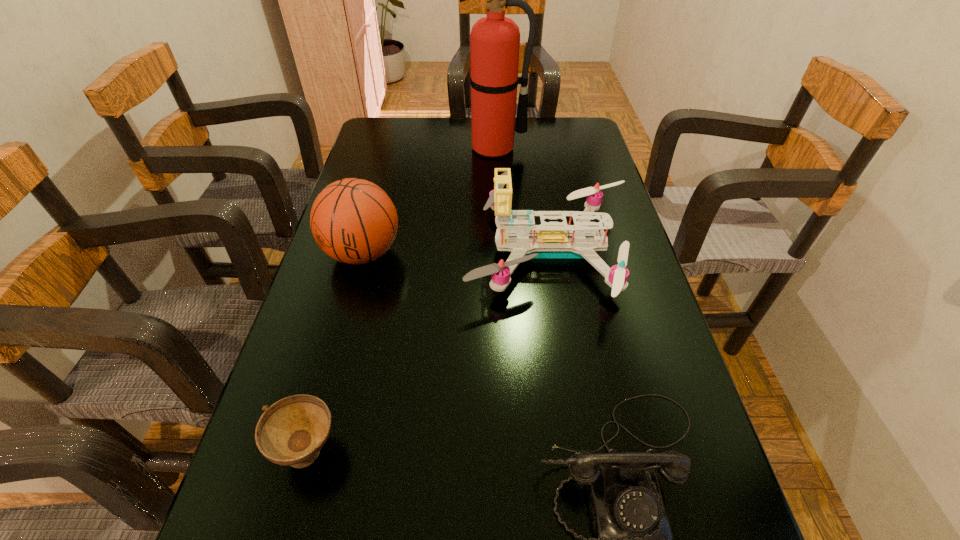
I want to click on free space located on the back of the soup bowl, so click(353, 285).

Locate an element on the screen. This screenshot has width=960, height=540. object that is positioned at the far edge is located at coordinates (494, 40).

Find the location of `basketball located in the left edge section of the desktop`. basketball located in the left edge section of the desktop is located at coordinates (354, 221).

Identify the location of soup bowl positioned at the left edge. This screenshot has width=960, height=540. (292, 431).

This screenshot has height=540, width=960. Find the location of `object located in the right edge section of the desktop`. object located in the right edge section of the desktop is located at coordinates (549, 239).

Locate an element on the screen. vacant region at the far edge of the desktop is located at coordinates [x=519, y=147].

I want to click on free point at the left edge, so click(388, 154).

This screenshot has height=540, width=960. In the image, there is a desktop. What are the coordinates of `free space at the right edge` in the screenshot? It's located at (581, 170).

In the image, there is a desktop. What are the coordinates of `vacant space at the far left corner` in the screenshot? It's located at tap(399, 131).

Identify the location of free space at the far right corner of the desktop. (582, 146).